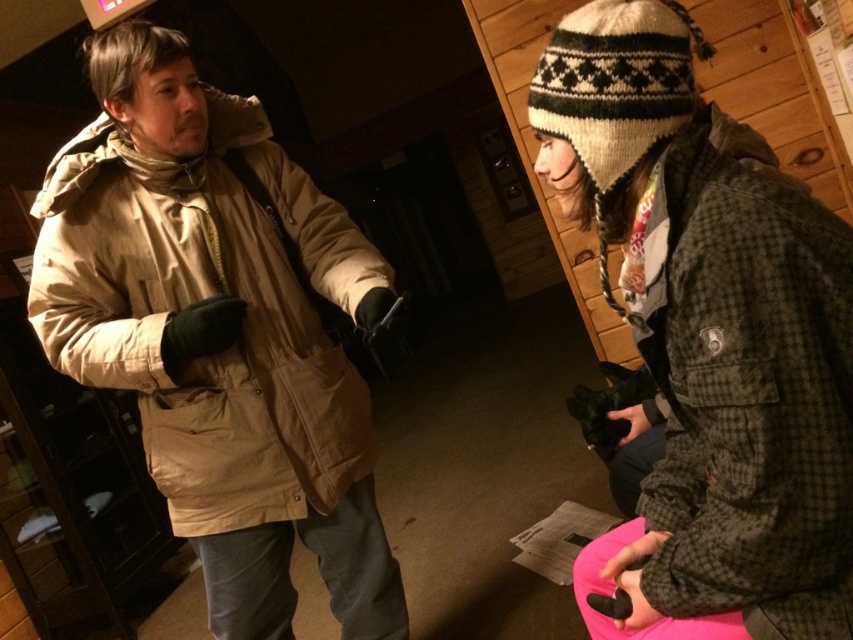
Question: Which of the following is the farthest from the observer?

Choices:
 (A) knitted woolen hat at upper right
 (B) beige cotton jacket at left

Answer: (B)

Question: Is beige cotton jacket at left above knitted woolen hat at upper right?

Choices:
 (A) no
 (B) yes

Answer: (A)

Question: Which point is closer to the camera taking this photo?

Choices:
 (A) (154, 266)
 (B) (674, 12)

Answer: (B)

Question: Is beige cotton jacket at left positioned in front of knitted woolen hat at upper right?

Choices:
 (A) yes
 (B) no

Answer: (B)

Question: Is beige cotton jacket at left below knitted woolen hat at upper right?

Choices:
 (A) yes
 (B) no

Answer: (A)